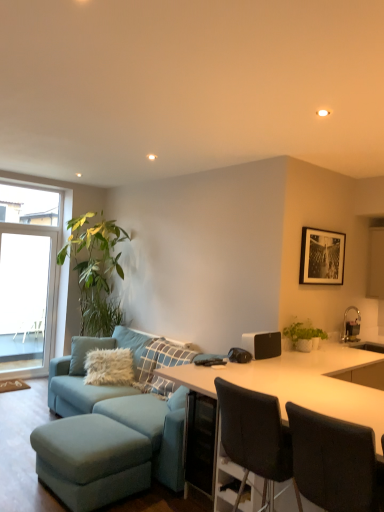
The width and height of the screenshot is (384, 512). Describe the element at coordinates (111, 449) in the screenshot. I see `matte blue fabric couch at lower left` at that location.

What is the approximate width of transparent glass window at left?

9.11 centimeters.

What is the approximate height of black fabric chair at lower right, the first chair positioned from the back?

black fabric chair at lower right, the first chair positioned from the back, is 34.70 inches tall.

This screenshot has width=384, height=512. What do you see at coordinates (161, 366) in the screenshot? I see `white fluffy pillow at center` at bounding box center [161, 366].

The image size is (384, 512). In order to click on black fabric chair at lower right, marked as the 1th chair in a front-to-back arrangement in this screenshot , I will do `click(335, 462)`.

This screenshot has width=384, height=512. Identify the location of matte blue fabric couch at lower left. (111, 449).

From the image's perspective, is green matte plant at right located above or below black fabric chair at lower right, acting as the second chair starting from the front?

Based on their image positions, green matte plant at right is located above black fabric chair at lower right, acting as the second chair starting from the front.

Considering the relative sizes of green matte plant at right and black fabric chair at lower right, acting as the second chair starting from the front, in the image provided, is green matte plant at right thinner than black fabric chair at lower right, acting as the second chair starting from the front,?

Correct, the width of green matte plant at right is less than that of black fabric chair at lower right, acting as the second chair starting from the front.

Is point (305, 330) positioned behind point (246, 455)?

Yes.

Could you tell me if green matte plant at right is facing black fabric chair at lower right, the first chair positioned from the back?

No, green matte plant at right is not facing towards black fabric chair at lower right, the first chair positioned from the back.

Which is correct: white matte speaker at center is inside transparent glass window at left, or outside of it?

white matte speaker at center is outside transparent glass window at left.

In terms of height, does white matte speaker at center look taller or shorter compared to transparent glass window at left?

In the image, white matte speaker at center appears to be shorter than transparent glass window at left.

Which object is positioned more to the left, white matte speaker at center or transparent glass window at left?

Positioned to the left is transparent glass window at left.

What's the angular difference between white matte speaker at center and transparent glass window at left's facing directions?

There is a 1.58-degree angle between the facing directions of white matte speaker at center and transparent glass window at left.

In the scene shown: Is green matte plant at right far away from black fabric chair at lower right, which is the second chair in back-to-front order?

green matte plant at right is far away from black fabric chair at lower right, which is the second chair in back-to-front order.

Who is smaller, green matte plant at right or black fabric chair at lower right, marked as the 1th chair in a front-to-back arrangement?

green matte plant at right is smaller.

Can you confirm if green matte plant at right is positioned to the left of black fabric chair at lower right, marked as the 1th chair in a front-to-back arrangement?

No, green matte plant at right is not to the left of black fabric chair at lower right, marked as the 1th chair in a front-to-back arrangement.

Can we say black fabric chair at lower right, acting as the second chair starting from the front, lies outside matte blue ottoman at lower left?

Yes, black fabric chair at lower right, acting as the second chair starting from the front, is not within matte blue ottoman at lower left.

Between black fabric chair at lower right, acting as the second chair starting from the front, and matte blue ottoman at lower left, which one appears on the right side from the viewer's perspective?

black fabric chair at lower right, acting as the second chair starting from the front.

Between black fabric chair at lower right, acting as the second chair starting from the front, and matte blue ottoman at lower left, which one has smaller width?

With smaller width is black fabric chair at lower right, acting as the second chair starting from the front.

Considering the relative positions of white matte speaker at center and white glossy desk at center in the image provided, is white matte speaker at center to the left of white glossy desk at center from the viewer's perspective?

Correct, you'll find white matte speaker at center to the left of white glossy desk at center.

Identify the location of appliance lying behind the white glossy desk at center. (262, 344).

How many degrees apart are the facing directions of white matte speaker at center and white glossy desk at center?

They differ by 2.1 degrees in their facing directions.

From the image's perspective, is white matte speaker at center located above or below white glossy desk at center?

Clearly, from the image's perspective, white matte speaker at center is above white glossy desk at center.

Is black fabric chair at lower right, acting as the second chair starting from the front, oriented away from black fabric chair at lower right, marked as the 1th chair in a front-to-back arrangement?

That's not correct — black fabric chair at lower right, acting as the second chair starting from the front, is not looking away from black fabric chair at lower right, marked as the 1th chair in a front-to-back arrangement.

Based on the photo, is black fabric chair at lower right, the first chair positioned from the back, far from black fabric chair at lower right, which is the second chair in back-to-front order?

No.

From a real-world perspective, which is physically below, black fabric chair at lower right, the first chair positioned from the back, or black fabric chair at lower right, which is the second chair in back-to-front order?

black fabric chair at lower right, the first chair positioned from the back, from a real-world perspective.

Can you confirm if green matte plant at right is thinner than white fluffy pillow at center?

Correct, the width of green matte plant at right is less than that of white fluffy pillow at center.

Which is further, [293,335] or [183,351]?

The point [183,351] is farther.

Is white fluffy pillow at center at the back of green matte plant at right?

No, green matte plant at right's orientation is not away from white fluffy pillow at center.

This screenshot has width=384, height=512. Find the location of `chair that is the 1st one when counting forward from the green matte plant at right`. chair that is the 1st one when counting forward from the green matte plant at right is located at coordinates (255, 437).

I want to click on window screen above the white matte speaker at center (from the image's perspective), so click(27, 298).

When comparing their distances from transparent glass window at left, does black paper at upper center or white matte speaker at center seem closer?

The object closer to transparent glass window at left is white matte speaker at center.

From the picture: Estimate the real-world distances between objects in this image. Which object is closer to black fabric chair at lower right, the first chair positioned from the back, white fluffy pillow at center or white matte speaker at center?

The object closer to black fabric chair at lower right, the first chair positioned from the back, is white matte speaker at center.

Estimate the real-world distances between objects in this image. Which object is further from white fluffy pillow at center, white matte speaker at center or green matte plant at right?

Among the two, green matte plant at right is located further to white fluffy pillow at center.

Estimate the real-world distances between objects in this image. Which object is further from white matte speaker at center, green matte plant at right or white fluffy pillow at center?

white fluffy pillow at center is positioned further to the anchor white matte speaker at center.

Which object lies nearer to the anchor point matte blue fabric couch at lower left, transparent glass window at left or white glossy desk at center?

white glossy desk at center lies closer to matte blue fabric couch at lower left than the other object.

From the image, which object appears to be nearer to white glossy desk at center, matte blue fabric couch at lower left or white fluffy pillow at center?

matte blue fabric couch at lower left is closer to white glossy desk at center.

Which object lies nearer to the anchor point white fluffy pillow at center, matte blue ottoman at lower left or black paper at upper center?

The object closer to white fluffy pillow at center is matte blue ottoman at lower left.

Based on their spatial positions, is matte blue fabric couch at lower left or green matte plant at right closer to white matte speaker at center?

Based on the image, green matte plant at right appears to be nearer to white matte speaker at center.

Where is `appliance between black fabric chair at lower right, acting as the second chair starting from the front, and green matte plant at right from front to back`? This screenshot has width=384, height=512. appliance between black fabric chair at lower right, acting as the second chair starting from the front, and green matte plant at right from front to back is located at coordinates (262, 344).

What are the coordinates of `houseplant between transparent glass window at left and white glossy desk at center from left to right` in the screenshot? It's located at tap(304, 335).

Find the location of a particular element. The width and height of the screenshot is (384, 512). pillow positioned between white glossy desk at center and transparent glass window at left from near to far is located at coordinates (161, 366).

What are the coordinates of `chair between black fabric chair at lower right, which is the second chair in back-to-front order, and white matte speaker at center, along the z-axis` in the screenshot? It's located at (255, 437).